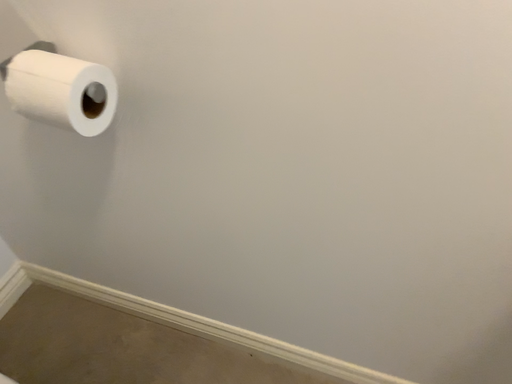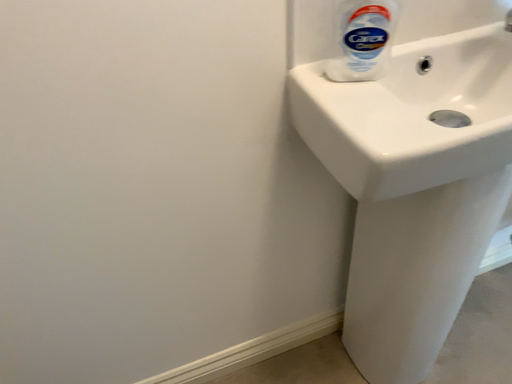
Question: How did the camera likely rotate when shooting the video?

Choices:
 (A) rotated downward
 (B) rotated upward

Answer: (B)